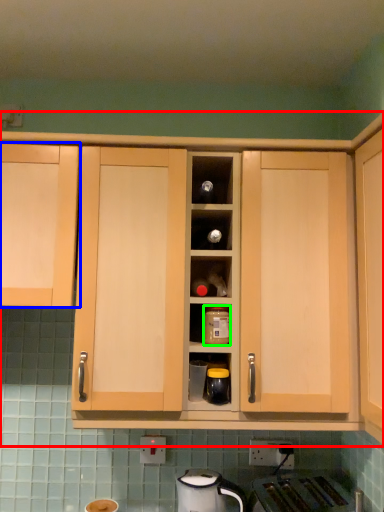
Question: Considering the real-world distances, which object is closest to cabinetry (highlighted by a red box)? cabinetry (highlighted by a blue box) or kitchen appliance (highlighted by a green box).

Choices:
 (A) cabinetry
 (B) kitchen appliance

Answer: (A)